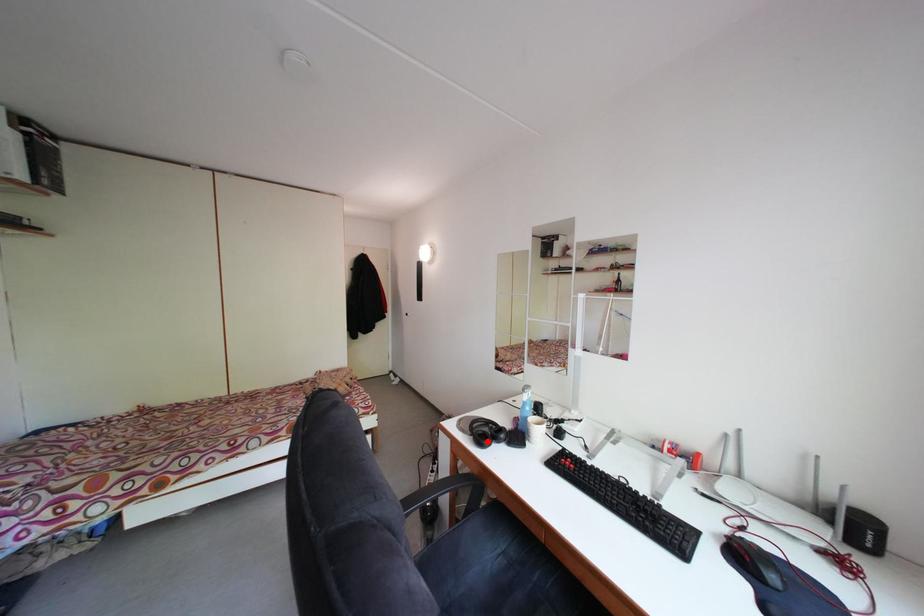
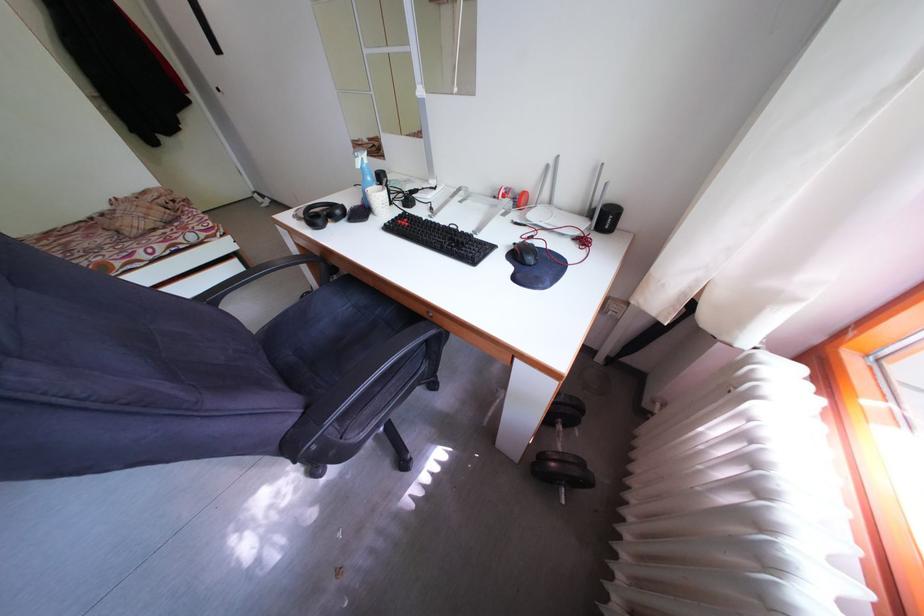
Question: I am providing you with two images of the same scene from different viewpoints. In image1, a red point is highlighted. Considering the same 3D point in image2, which of the following is correct?

Choices:
 (A) It is closer
 (B) It is farther

Answer: (A)